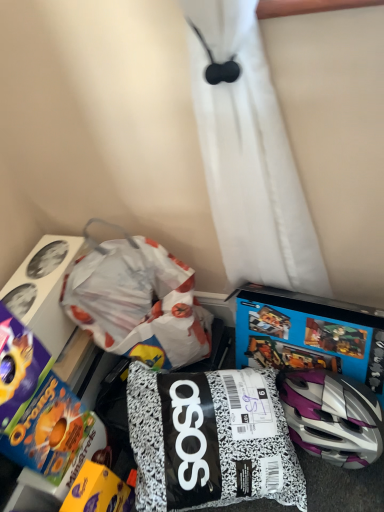
Identify the location of black and white speckled bag at center, which is counted as the 3th toy, starting from the left. The width and height of the screenshot is (384, 512). (342, 486).

Locate an element on the screen. blue cardboard video game at lower right is located at coordinates (310, 334).

Image resolution: width=384 pixels, height=512 pixels. Find the location of `blue cardboard cereal box at lower left, positioned as the third toy in right-to-left order`. blue cardboard cereal box at lower left, positioned as the third toy in right-to-left order is located at coordinates (51, 435).

What do you see at coordinates (138, 303) in the screenshot? I see `white paper bag at center` at bounding box center [138, 303].

The width and height of the screenshot is (384, 512). What are the coordinates of `black and white speckled bag at center, which is counted as the 3th toy, starting from the left` in the screenshot? It's located at (342, 486).

Does blue cardboard cereal box at lower left, positioned as the third toy in right-to-left order, appear on the right side of white paper bag at center?

No, blue cardboard cereal box at lower left, positioned as the third toy in right-to-left order, is not to the right of white paper bag at center.

Is point (99, 419) in front of point (100, 254)?

Yes, it is.

Is blue cardboard cereal box at lower left, the 1th toy when ordered from left to right, further to the viewer compared to white paper bag at center?

That is False.

Is there a large distance between blue cardboard cereal box at lower left, positioned as the third toy in right-to-left order, and white paper bag at center?

No, there isn't a large distance between blue cardboard cereal box at lower left, positioned as the third toy in right-to-left order, and white paper bag at center.

Which object is closer to the camera taking this photo, yellow matte chocolate bar at lower left, positioned as the second toy in right-to-left order, or blue cardboard video game at lower right?

yellow matte chocolate bar at lower left, positioned as the second toy in right-to-left order, is in front.

From the image's perspective, between yellow matte chocolate bar at lower left, positioned as the second toy in right-to-left order, and blue cardboard video game at lower right, which one is located above?

blue cardboard video game at lower right appears higher in the image.

Between point (109, 510) and point (283, 323), which one is positioned in front?

The point (109, 510) is closer.

From a real-world perspective, between yellow matte chocolate bar at lower left, marked as the 2th toy in a left-to-right arrangement, and blue cardboard video game at lower right, who is vertically higher?

From a 3D spatial view, blue cardboard video game at lower right is above.

This screenshot has height=512, width=384. What are the coordinates of `the 2nd toy to the left when counting from the white paper bag at center` in the screenshot? It's located at (51, 435).

Is white paper bag at center positioned with its back to blue cardboard cereal box at lower left, positioned as the third toy in right-to-left order?

No, blue cardboard cereal box at lower left, positioned as the third toy in right-to-left order, is not at the back of white paper bag at center.

Considering the relative sizes of white paper bag at center and blue cardboard cereal box at lower left, the 1th toy when ordered from left to right, in the image provided, is white paper bag at center wider than blue cardboard cereal box at lower left, the 1th toy when ordered from left to right,?

Yes.

Would you say white paper bag at center is to the left or to the right of blue cardboard cereal box at lower left, the 1th toy when ordered from left to right, in the picture?

From the image, it's evident that white paper bag at center is to the right of blue cardboard cereal box at lower left, the 1th toy when ordered from left to right.

Image resolution: width=384 pixels, height=512 pixels. I want to click on the 1st toy located above the yellow matte chocolate bar at lower left, positioned as the second toy in right-to-left order (from a real-world perspective), so click(x=342, y=486).

Does point (226, 359) come closer to viewer compared to point (95, 498)?

No.

Considering the relative sizes of black and white speckled bag at center, which is the 1th toy in right-to-left order, and yellow matte chocolate bar at lower left, positioned as the second toy in right-to-left order, in the image provided, is black and white speckled bag at center, which is the 1th toy in right-to-left order, shorter than yellow matte chocolate bar at lower left, positioned as the second toy in right-to-left order,?

In fact, black and white speckled bag at center, which is the 1th toy in right-to-left order, may be taller than yellow matte chocolate bar at lower left, positioned as the second toy in right-to-left order.

Is black and white speckled bag at center, which is the 1th toy in right-to-left order, positioned with its back to yellow matte chocolate bar at lower left, positioned as the second toy in right-to-left order?

No, yellow matte chocolate bar at lower left, positioned as the second toy in right-to-left order, is not at the back of black and white speckled bag at center, which is the 1th toy in right-to-left order.

Is black and white speckled bag at center, which is the 1th toy in right-to-left order, inside or outside of blue cardboard video game at lower right?

black and white speckled bag at center, which is the 1th toy in right-to-left order, is not enclosed by blue cardboard video game at lower right.

From a real-world perspective, is black and white speckled bag at center, which is the 1th toy in right-to-left order, on top of blue cardboard video game at lower right?

Yes.

Could you tell me if black and white speckled bag at center, which is counted as the 3th toy, starting from the left, is facing blue cardboard video game at lower right?

No, black and white speckled bag at center, which is counted as the 3th toy, starting from the left, is not turned towards blue cardboard video game at lower right.

Considering the relative sizes of black and white speckled bag at center, which is the 1th toy in right-to-left order, and blue cardboard video game at lower right in the image provided, is black and white speckled bag at center, which is the 1th toy in right-to-left order, smaller than blue cardboard video game at lower right?

Actually, black and white speckled bag at center, which is the 1th toy in right-to-left order, might be larger than blue cardboard video game at lower right.

Does white paper bag at center come behind yellow matte chocolate bar at lower left, positioned as the second toy in right-to-left order?

Yes, white paper bag at center is behind yellow matte chocolate bar at lower left, positioned as the second toy in right-to-left order.

Does white paper bag at center have a greater height compared to yellow matte chocolate bar at lower left, marked as the 2th toy in a left-to-right arrangement?

Correct, white paper bag at center is much taller as yellow matte chocolate bar at lower left, marked as the 2th toy in a left-to-right arrangement.

Is white paper bag at center wider than yellow matte chocolate bar at lower left, positioned as the second toy in right-to-left order?

Yes, white paper bag at center is wider than yellow matte chocolate bar at lower left, positioned as the second toy in right-to-left order.

Considering the positions of objects blue cardboard video game at lower right and black and white speckled bag at center, which is the 1th toy in right-to-left order, in the image provided, who is behind, blue cardboard video game at lower right or black and white speckled bag at center, which is the 1th toy in right-to-left order,?

Positioned behind is blue cardboard video game at lower right.

Based on the photo, considering the relative positions of blue cardboard video game at lower right and black and white speckled bag at center, which is the 1th toy in right-to-left order, in the image provided, is blue cardboard video game at lower right to the right of black and white speckled bag at center, which is the 1th toy in right-to-left order, from the viewer's perspective?

Yes.

From a real-world perspective, which is physically below, blue cardboard video game at lower right or black and white speckled bag at center, which is counted as the 3th toy, starting from the left?

blue cardboard video game at lower right.

How many degrees apart are the facing directions of blue cardboard video game at lower right and black and white speckled bag at center, which is the 1th toy in right-to-left order?

There is a 69-degree angle between the facing directions of blue cardboard video game at lower right and black and white speckled bag at center, which is the 1th toy in right-to-left order.

Where is `waste on the right of blue cardboard cereal box at lower left, positioned as the third toy in right-to-left order`? This screenshot has height=512, width=384. waste on the right of blue cardboard cereal box at lower left, positioned as the third toy in right-to-left order is located at coordinates (138, 303).

Find the location of `the 2nd toy counting from the left side of the blue cardboard video game at lower right`. the 2nd toy counting from the left side of the blue cardboard video game at lower right is located at coordinates coord(98,490).

Estimate the real-world distances between objects in this image. Which object is closer to blue cardboard cereal box at lower left, the 1th toy when ordered from left to right, black and white speckled bag at center, which is counted as the 3th toy, starting from the left, or white paper bag at center?

Among the two, black and white speckled bag at center, which is counted as the 3th toy, starting from the left, is located nearer to blue cardboard cereal box at lower left, the 1th toy when ordered from left to right.

Considering their positions, is blue cardboard video game at lower right positioned closer to blue cardboard cereal box at lower left, positioned as the third toy in right-to-left order, than yellow matte chocolate bar at lower left, marked as the 2th toy in a left-to-right arrangement?

Among the two, yellow matte chocolate bar at lower left, marked as the 2th toy in a left-to-right arrangement, is located nearer to blue cardboard cereal box at lower left, positioned as the third toy in right-to-left order.

Considering their positions, is black and white speckled bag at center, which is the 1th toy in right-to-left order, positioned closer to white paper bag at center than blue cardboard cereal box at lower left, the 1th toy when ordered from left to right?

black and white speckled bag at center, which is the 1th toy in right-to-left order.

Which object lies further to the anchor point blue cardboard cereal box at lower left, the 1th toy when ordered from left to right, blue cardboard video game at lower right or black and white speckled bag at center, which is counted as the 3th toy, starting from the left?

Among the two, blue cardboard video game at lower right is located further to blue cardboard cereal box at lower left, the 1th toy when ordered from left to right.

Looking at the image, which one is located further to black and white speckled bag at center, which is counted as the 3th toy, starting from the left, yellow matte chocolate bar at lower left, marked as the 2th toy in a left-to-right arrangement, or white paper bag at center?

white paper bag at center.

From the picture: Looking at the image, which one is located further to yellow matte chocolate bar at lower left, marked as the 2th toy in a left-to-right arrangement, blue cardboard video game at lower right or blue cardboard cereal box at lower left, the 1th toy when ordered from left to right?

blue cardboard video game at lower right lies further to yellow matte chocolate bar at lower left, marked as the 2th toy in a left-to-right arrangement, than the other object.

When comparing their distances from yellow matte chocolate bar at lower left, positioned as the second toy in right-to-left order, does blue cardboard cereal box at lower left, positioned as the third toy in right-to-left order, or blue cardboard video game at lower right seem closer?

Based on the image, blue cardboard cereal box at lower left, positioned as the third toy in right-to-left order, appears to be nearer to yellow matte chocolate bar at lower left, positioned as the second toy in right-to-left order.

Which object lies further to the anchor point blue cardboard video game at lower right, black and white speckled bag at center, which is the 1th toy in right-to-left order, or blue cardboard cereal box at lower left, positioned as the third toy in right-to-left order?

blue cardboard cereal box at lower left, positioned as the third toy in right-to-left order, is positioned further to the anchor blue cardboard video game at lower right.

Where is `toy between white paper bag at center and blue cardboard video game at lower right`? The image size is (384, 512). toy between white paper bag at center and blue cardboard video game at lower right is located at coordinates (342, 486).

I want to click on toy between blue cardboard cereal box at lower left, the 1th toy when ordered from left to right, and black and white speckled bag at center, which is counted as the 3th toy, starting from the left, so click(x=98, y=490).

This screenshot has height=512, width=384. I want to click on toy located between yellow matte chocolate bar at lower left, positioned as the second toy in right-to-left order, and blue cardboard video game at lower right in the left-right direction, so click(342, 486).

The height and width of the screenshot is (512, 384). I want to click on waste between blue cardboard cereal box at lower left, positioned as the third toy in right-to-left order, and blue cardboard video game at lower right, in the horizontal direction, so click(x=138, y=303).